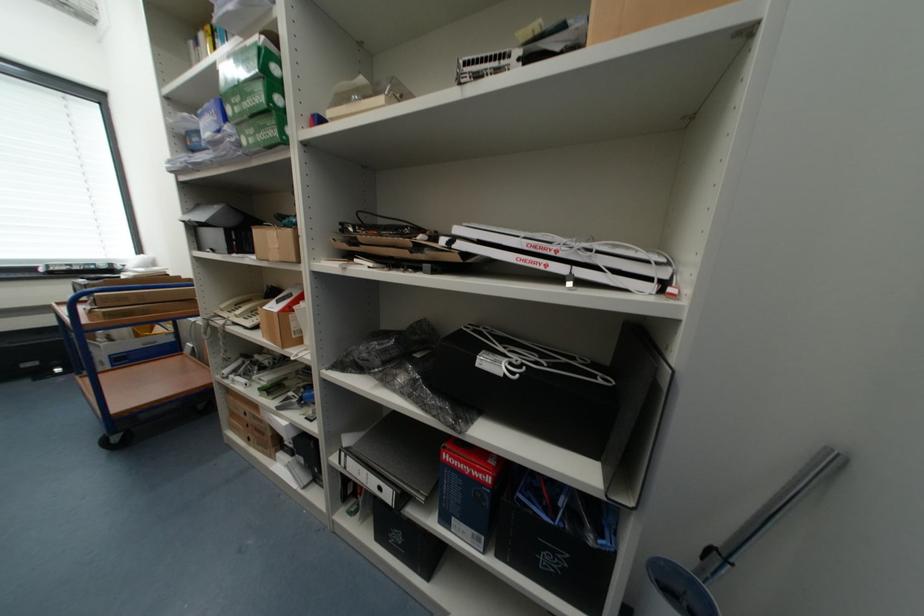
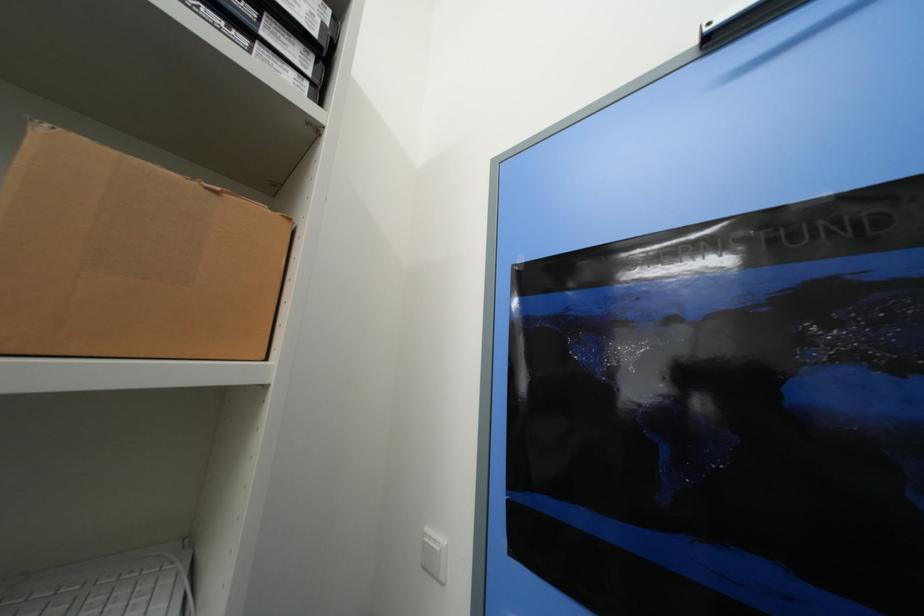
Question: Based on the continuous images, in which direction is the camera rotating? Reply with the corresponding letter.

Choices:
 (A) Left
 (B) Right
 (C) Up
 (D) Down

Answer: (B)